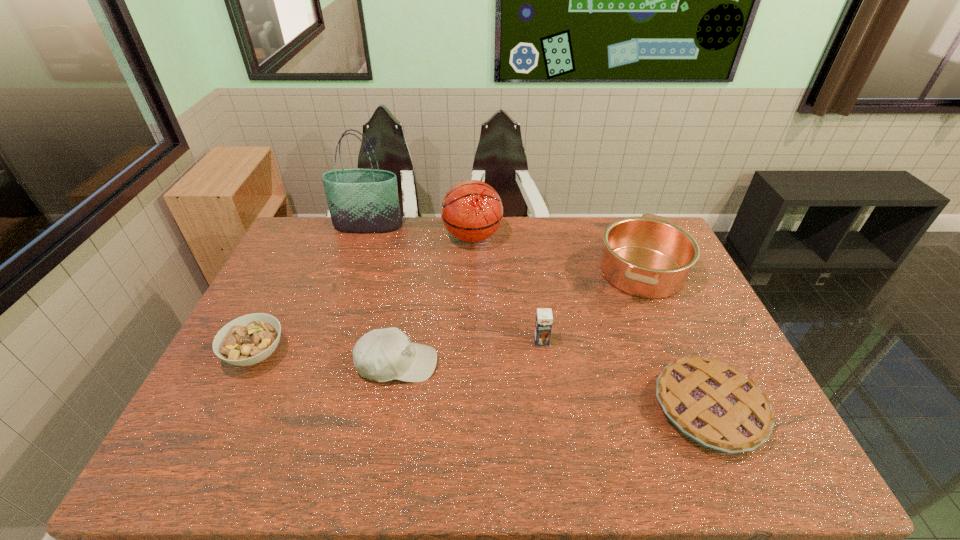
This screenshot has width=960, height=540. Find the location of `saucepan that is at the right edge`. saucepan that is at the right edge is located at coordinates (649, 257).

Locate an element on the screen. The height and width of the screenshot is (540, 960). pie situated at the right edge is located at coordinates (715, 405).

You are a GUI agent. You are given a task and a screenshot of the screen. Output one action in this format:
    pyautogui.click(x=<x>, y=<y>)
    Task: Click on the object that is at the far left corner
    This screenshot has width=960, height=540.
    Given the screenshot: What is the action you would take?
    pyautogui.click(x=360, y=200)

The image size is (960, 540). Identify the location of object that is at the far right corner. (649, 257).

Find the location of `object situated at the near right corner`. object situated at the near right corner is located at coordinates (715, 405).

In the image, there is a desktop. At what (x,y) coordinates should I click in order to perform the action: click on vacant space at the far edge. Please return your answer as a coordinate pair (x, y). This screenshot has width=960, height=540. Looking at the image, I should click on (408, 255).

Find the location of a particular element. The image size is (960, 540). vacant space at the near edge of the desktop is located at coordinates (529, 474).

The image size is (960, 540). In order to click on blank area at the right edge in this screenshot , I will do `click(706, 349)`.

Identify the location of vacant space at the near left corner of the desktop. The height and width of the screenshot is (540, 960). (202, 456).

Identify the location of vacant point located between the pie and the sixth shortest object. (590, 323).